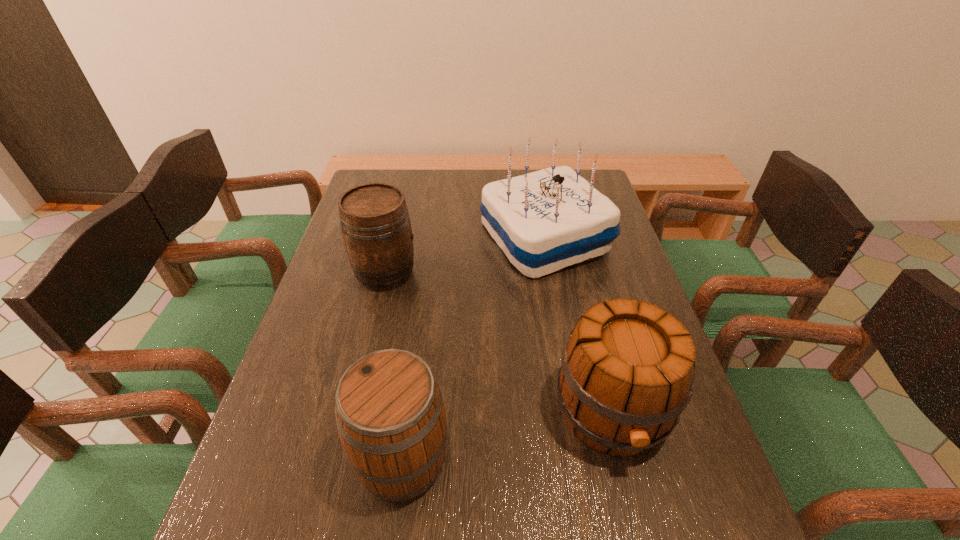
Identify the location of birthday cake. (544, 221).

Image resolution: width=960 pixels, height=540 pixels. Identify the location of the farthest cider. (375, 224).

Where is `the rightmost cider`? The width and height of the screenshot is (960, 540). the rightmost cider is located at coordinates [627, 373].

The width and height of the screenshot is (960, 540). I want to click on free space located 0.180m on the left of the birthday cake, so click(423, 238).

Locate an element on the screen. This screenshot has height=540, width=960. free space located on the side of the farthest cider near the bung hole is located at coordinates (536, 273).

Identify the location of blank space located 0.080m on the side of the rightmost cider where the spigot is located. The width and height of the screenshot is (960, 540). (637, 519).

Locate an element on the screen. This screenshot has width=960, height=540. object situated at the far edge is located at coordinates (544, 221).

Identify the location of object positioned at the left edge. The image size is (960, 540). (375, 224).

Where is `birthday cake at the right edge`? birthday cake at the right edge is located at coordinates (544, 221).

Where is `cider present at the right edge`? This screenshot has height=540, width=960. cider present at the right edge is located at coordinates (627, 373).